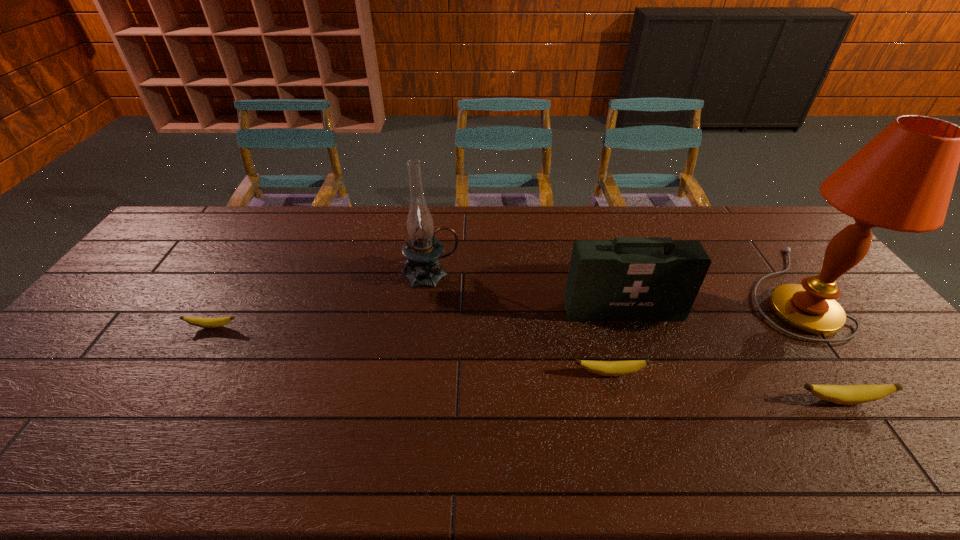
Locate an element on the screen. free space between the farthest banana and the fifth object from right to left is located at coordinates pyautogui.click(x=322, y=301).

Identify the location of free space between the nearest banana and the second tallest object. (636, 338).

You are a GUI agent. You are given a task and a screenshot of the screen. Output one action in this format:
    pyautogui.click(x=<x>, y=<y>)
    Task: Click on the vacant point located between the second shortest banana and the lamp
    The image size is (960, 540).
    Given the screenshot: What is the action you would take?
    pyautogui.click(x=698, y=332)

This screenshot has width=960, height=540. What are the coordinates of `free space between the second banana from left to right and the farthest banana` in the screenshot? It's located at (411, 350).

Locate which object ranks third in proximity to the rightmost banana. Please provide its 2D coordinates. Your answer should be formatted as a tuple, i.e. [(x, y)], where the tuple contains the x and y coordinates of a point satisfying the conditions above.

[(606, 368)]

Identify which object is the second closest to the leftmost object. Please provide its 2D coordinates. Your answer should be formatted as a tuple, i.e. [(x, y)], where the tuple contains the x and y coordinates of a point satisfying the conditions above.

[(606, 368)]

Locate an element on the screen. This screenshot has width=960, height=540. banana object that ranks as the closest to the second nearest object is located at coordinates [840, 394].

What are the coordinates of `banana that is the second closest to the tallest banana` in the screenshot? It's located at (201, 322).

Where is `vacant position in the image that satisfies the following two spatial constraints: 1. on the back side of the leftmost object; 2. on the left side of the second object from left to right`? vacant position in the image that satisfies the following two spatial constraints: 1. on the back side of the leftmost object; 2. on the left side of the second object from left to right is located at coordinates (244, 274).

The image size is (960, 540). In order to click on free space that satisfies the following two spatial constraints: 1. on the front-facing side of the first-aid kit; 2. on the left side of the tallest banana in this screenshot , I will do `click(652, 400)`.